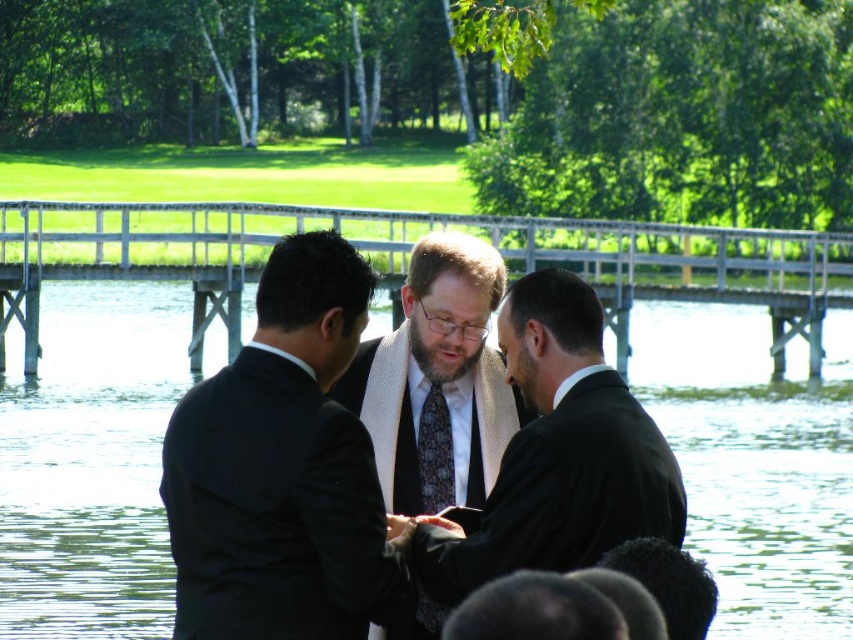
You are standing at the edge of the lake and want to reach the white wooden dock at center. According to the coordinates provided, in which direction should you move relative to your current position?

The white wooden dock at center is located at coordinates 0.402 on the x axis and 0.479 on the y axis. Since you are at the edge of the lake, you need to move towards the center of the lake to reach it.

You are a photographer standing at the edge of the lake, and you want to capture a closeup of the ties worn by the men in the center. Which tie, the patterned silk tie at center or the multicolored patterned tie at center, will appear larger in your photo?

The multicolored patterned tie at center will appear larger in the photo because it is longer than the patterned silk tie at center.